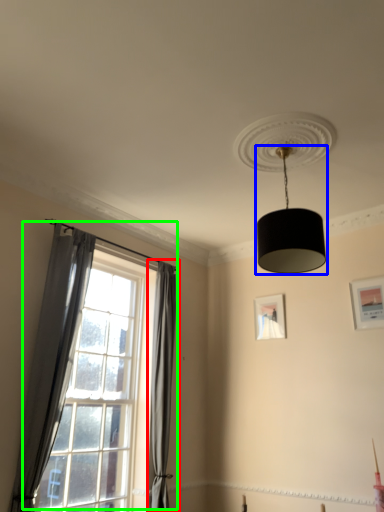
Question: Which is farther away from curtain (highlighted by a red box)? lamp (highlighted by a blue box) or window (highlighted by a green box)?

Choices:
 (A) lamp
 (B) window

Answer: (A)